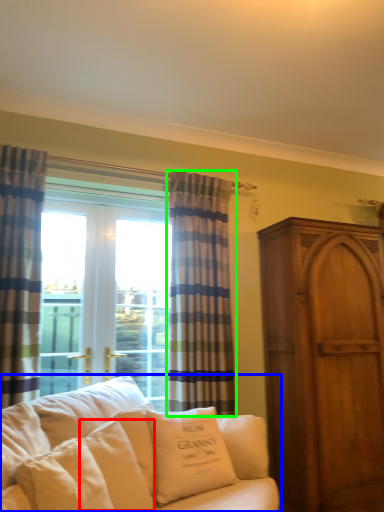
Question: Based on their relative distances, which object is farther from pillow (highlighted by a red box)? Choose from studio couch (highlighted by a blue box) and curtain (highlighted by a green box).

Choices:
 (A) studio couch
 (B) curtain

Answer: (B)